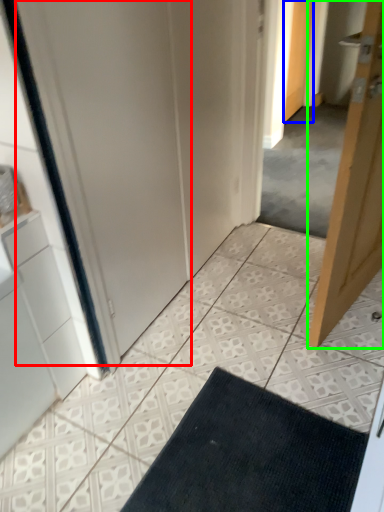
Question: Which object is the closest to the screen door (highlighted by a red box)? Choose among these: door (highlighted by a blue box) or door (highlighted by a green box).

Choices:
 (A) door
 (B) door

Answer: (B)